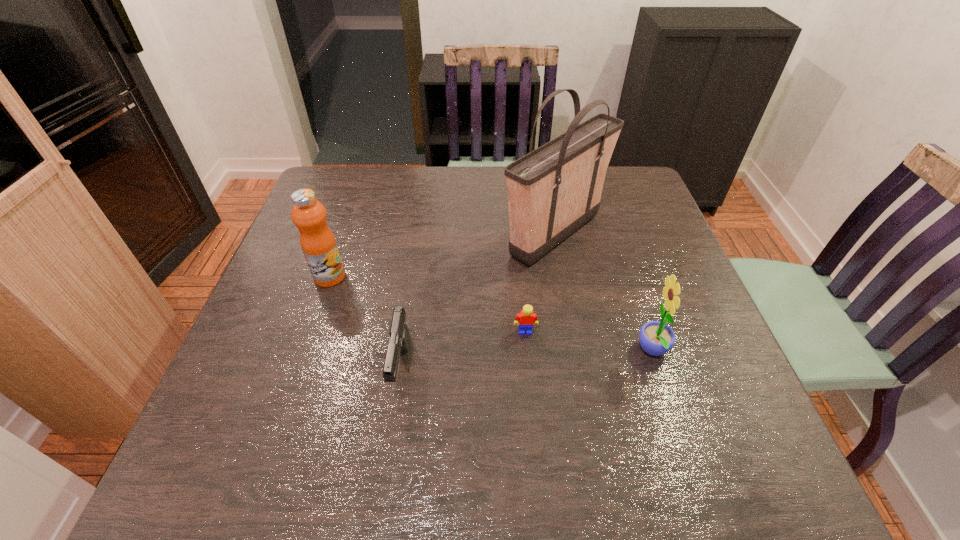
Image resolution: width=960 pixels, height=540 pixels. Identify the location of the tallest object. (555, 189).

Where is `fruit juice`? Image resolution: width=960 pixels, height=540 pixels. fruit juice is located at coordinates (318, 243).

This screenshot has height=540, width=960. Find the location of `sunflower`. sunflower is located at coordinates (656, 338).

Where is `pistol`? pistol is located at coordinates (399, 340).

At what (x,y) coordinates should I click in order to perform the action: click on the fourth tallest object. Please return your answer as a coordinate pair (x, y). The height and width of the screenshot is (540, 960). Looking at the image, I should click on (399, 340).

Locate an element on the screen. The width and height of the screenshot is (960, 540). the shortest object is located at coordinates (526, 318).

Where is `vacant space located on the back of the tallest object`? The image size is (960, 540). vacant space located on the back of the tallest object is located at coordinates (544, 178).

You are a GUI agent. You are given a task and a screenshot of the screen. Output one action in this format:
    pyautogui.click(x=<x>, y=<y>)
    Task: Click on the free space located on the back of the leftmost object
    
    Given the screenshot: What is the action you would take?
    pyautogui.click(x=361, y=185)

Locate an element on the screen. free region located on the front-facing side of the third tallest object is located at coordinates (447, 351).

Identify the location of blank space located 0.220m on the front-facing side of the third tallest object. (532, 351).